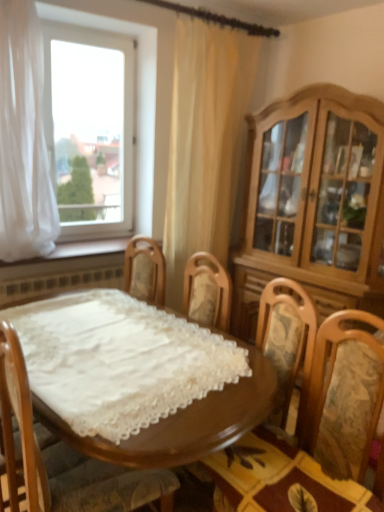
Question: Considering the relative positions of light brown wood cabinet at right and wooden chair with floral cushion at center in the image provided, is light brown wood cabinet at right to the left of wooden chair with floral cushion at center from the viewer's perspective?

Choices:
 (A) yes
 (B) no

Answer: (B)

Question: Is light brown wood cabinet at right further to camera compared to wooden chair with floral cushion at center?

Choices:
 (A) yes
 (B) no

Answer: (A)

Question: Considering the relative sizes of light brown wood cabinet at right and wooden chair with floral cushion at center in the image provided, is light brown wood cabinet at right wider than wooden chair with floral cushion at center?

Choices:
 (A) yes
 (B) no

Answer: (A)

Question: Could you tell me if light brown wood cabinet at right is turned towards wooden chair with floral cushion at center?

Choices:
 (A) yes
 (B) no

Answer: (A)

Question: Is wooden chair with floral cushion at center located within light brown wood cabinet at right?

Choices:
 (A) yes
 (B) no

Answer: (B)

Question: Considering the positions of white sheer curtain at left, which appears as the 2th curtain when viewed from the right, and wooden at lower left in the image, is white sheer curtain at left, which appears as the 2th curtain when viewed from the right, wider or thinner than wooden at lower left?

Choices:
 (A) wide
 (B) thin

Answer: (A)

Question: Considering the positions of point (18, 230) and point (87, 245), is point (18, 230) closer or farther from the camera than point (87, 245)?

Choices:
 (A) farther
 (B) closer

Answer: (B)

Question: From a real-world perspective, relative to wooden at lower left, is white sheer curtain at left, marked as the 1th curtain in a left-to-right arrangement, vertically above or below?

Choices:
 (A) above
 (B) below

Answer: (A)

Question: In terms of height, does white sheer curtain at left, which appears as the 2th curtain when viewed from the right, look taller or shorter compared to wooden at lower left?

Choices:
 (A) tall
 (B) short

Answer: (A)

Question: Looking at the image, does transparent glass window at upper left seem bigger or smaller compared to white sheer curtain at left, which appears as the 2th curtain when viewed from the right?

Choices:
 (A) small
 (B) big

Answer: (A)

Question: In the image, is transparent glass window at upper left positioned in front of or behind white sheer curtain at left, marked as the 1th curtain in a left-to-right arrangement?

Choices:
 (A) behind
 (B) front

Answer: (A)

Question: From a real-world perspective, is transparent glass window at upper left physically located above or below white sheer curtain at left, which appears as the 2th curtain when viewed from the right?

Choices:
 (A) below
 (B) above

Answer: (A)

Question: Is transparent glass window at upper left wider or thinner than white sheer curtain at left, which appears as the 2th curtain when viewed from the right?

Choices:
 (A) thin
 (B) wide

Answer: (A)

Question: Based on their positions, is beige fabric curtain at upper center, arranged as the 2th curtain when viewed from the left, located to the left or right of light brown wood cabinet at right?

Choices:
 (A) right
 (B) left

Answer: (B)

Question: Considering their positions, is beige fabric curtain at upper center, arranged as the 2th curtain when viewed from the left, located in front of or behind light brown wood cabinet at right?

Choices:
 (A) behind
 (B) front

Answer: (A)